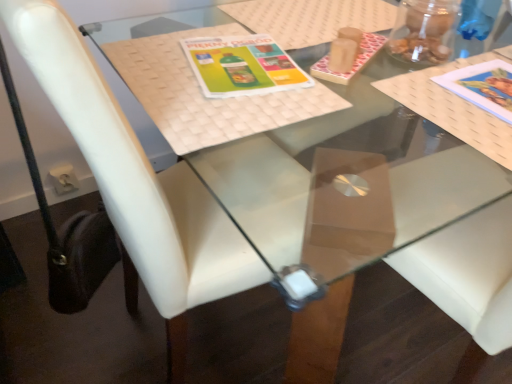
Where is `unoccupied space behind matte green plastic book cover at center, the first book cover viewed from the left`? Image resolution: width=512 pixels, height=384 pixels. unoccupied space behind matte green plastic book cover at center, the first book cover viewed from the left is located at coordinates (238, 25).